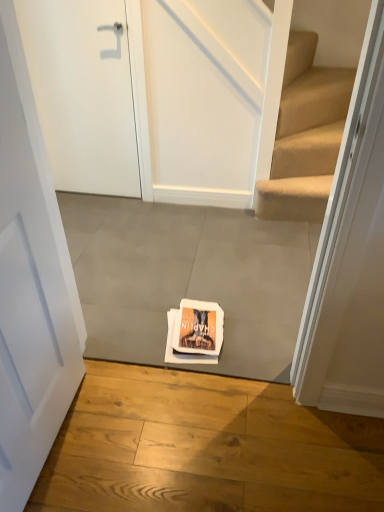
Question: Can you confirm if gray concrete at center, the first concrete in the top-to-bottom sequence, is positioned to the left of white matte door at upper left, positioned as the 1th door in top-to-bottom order?

Choices:
 (A) yes
 (B) no

Answer: (B)

Question: Is gray concrete at center, which ranks as the second concrete in front-to-back order, to the right of white matte door at upper left, which ranks as the 2th door in bottom-to-top order, from the viewer's perspective?

Choices:
 (A) no
 (B) yes

Answer: (B)

Question: Considering the relative sizes of gray concrete at center, the first concrete in the top-to-bottom sequence, and white matte door at upper left, which ranks as the 2th door in bottom-to-top order, in the image provided, is gray concrete at center, the first concrete in the top-to-bottom sequence, bigger than white matte door at upper left, which ranks as the 2th door in bottom-to-top order,?

Choices:
 (A) no
 (B) yes

Answer: (B)

Question: Considering the relative sizes of gray concrete at center, which ranks as the second concrete in front-to-back order, and white matte door at upper left, placed as the second door when sorted from front to back, in the image provided, is gray concrete at center, which ranks as the second concrete in front-to-back order, taller than white matte door at upper left, placed as the second door when sorted from front to back,?

Choices:
 (A) yes
 (B) no

Answer: (B)

Question: From a real-world perspective, is gray concrete at center, the 2th concrete in the bottom-to-top sequence, positioned over white matte door at upper left, which ranks as the 2th door in bottom-to-top order, based on gravity?

Choices:
 (A) yes
 (B) no

Answer: (B)

Question: Is gray concrete at center, which ranks as the second concrete in front-to-back order, outside white matte door at upper left, which ranks as the 2th door in bottom-to-top order?

Choices:
 (A) yes
 (B) no

Answer: (A)

Question: Is white matte door at center, the second door viewed from the top, closer to camera compared to gray concrete at center, acting as the 1th concrete starting from the back?

Choices:
 (A) yes
 (B) no

Answer: (A)

Question: Can you confirm if white matte door at center, acting as the 2th door starting from the back, is positioned to the left of gray concrete at center, acting as the 1th concrete starting from the back?

Choices:
 (A) yes
 (B) no

Answer: (A)

Question: Considering the relative sizes of white matte door at center, the second door viewed from the top, and gray concrete at center, the 2th concrete in the bottom-to-top sequence, in the image provided, is white matte door at center, the second door viewed from the top, smaller than gray concrete at center, the 2th concrete in the bottom-to-top sequence,?

Choices:
 (A) yes
 (B) no

Answer: (A)

Question: Would you say gray concrete at center, the 2th concrete in the bottom-to-top sequence, is part of white matte door at center, the second door viewed from the top,'s contents?

Choices:
 (A) no
 (B) yes

Answer: (A)

Question: Is white matte door at center, which appears as the first door when ordered from the bottom, not near gray concrete at center, the first concrete in the top-to-bottom sequence?

Choices:
 (A) no
 (B) yes

Answer: (A)

Question: Is the position of white matte door at center, which is counted as the first door, starting from the front, more distant than that of gray concrete at center, the 2th concrete in the bottom-to-top sequence?

Choices:
 (A) no
 (B) yes

Answer: (A)

Question: Is white matte door at center, which appears as the first door when ordered from the bottom, further to camera compared to gray concrete at center, the second concrete from the top?

Choices:
 (A) yes
 (B) no

Answer: (B)